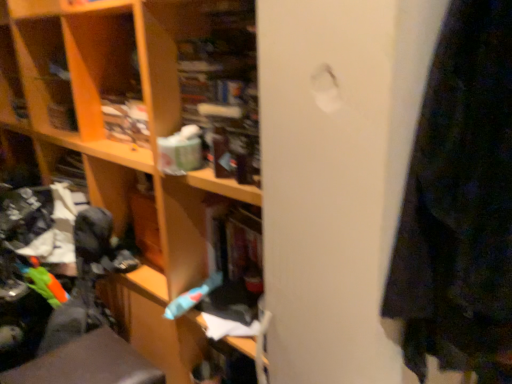
Question: From a real-world perspective, is metallic gray swivel chair at lower left positioned above or below rubberized blue toothbrush at center?

Choices:
 (A) below
 (B) above

Answer: (A)

Question: From the image's perspective, is metallic gray swivel chair at lower left above or below rubberized blue toothbrush at center?

Choices:
 (A) below
 (B) above

Answer: (A)

Question: Looking at their shapes, would you say metallic gray swivel chair at lower left is wider or thinner than rubberized blue toothbrush at center?

Choices:
 (A) thin
 (B) wide

Answer: (B)

Question: In terms of height, does rubberized blue toothbrush at center look taller or shorter compared to metallic gray swivel chair at lower left?

Choices:
 (A) short
 (B) tall

Answer: (A)

Question: Is rubberized blue toothbrush at center to the left or to the right of metallic gray swivel chair at lower left in the image?

Choices:
 (A) left
 (B) right

Answer: (B)

Question: Considering the positions of rubberized blue toothbrush at center and metallic gray swivel chair at lower left in the image, is rubberized blue toothbrush at center wider or thinner than metallic gray swivel chair at lower left?

Choices:
 (A) wide
 (B) thin

Answer: (B)

Question: Is rubberized blue toothbrush at center in front of or behind metallic gray swivel chair at lower left in the image?

Choices:
 (A) front
 (B) behind

Answer: (B)